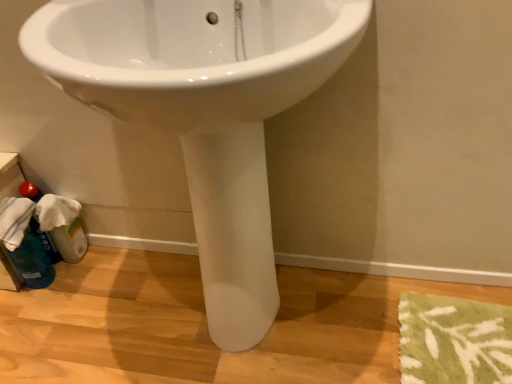
Where is `free space to the left of white glossy sink at center`? This screenshot has width=512, height=384. free space to the left of white glossy sink at center is located at coordinates (82, 304).